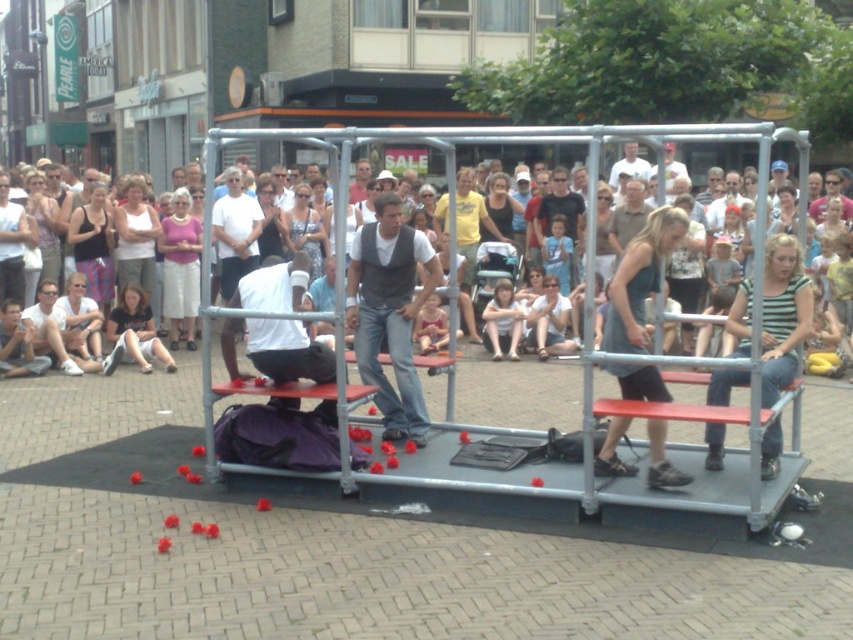
Does denim jeans at center have a lesser height compared to white tank top at center?

No, denim jeans at center is not shorter than white tank top at center.

Is denim jeans at center in front of white tank top at center?

Yes, denim jeans at center is closer to the viewer.

Between point (355, 330) and point (154, 252), which one is positioned in front?

Point (355, 330)

In order to click on denim jeans at center in this screenshot , I will do `click(389, 312)`.

Can you confirm if matte white crowd at center is wider than white tank top at center?

Incorrect, matte white crowd at center's width does not surpass white tank top at center's.

Can you confirm if matte white crowd at center is positioned below white tank top at center?

Correct, matte white crowd at center is located below white tank top at center.

Between point (756, 378) and point (131, 205), which one is positioned behind?

Point (131, 205)

Where is `matte white crowd at center`? matte white crowd at center is located at coordinates (585, 240).

Is matte pink blouse at center below matte gray vest at center?

Indeed, matte pink blouse at center is positioned under matte gray vest at center.

Which is more to the left, matte pink blouse at center or matte gray vest at center?

matte pink blouse at center

Who is more distant from viewer, [163,269] or [639,172]?

Point [639,172]

You are a GUI agent. You are given a task and a screenshot of the screen. Output one action in this format:
    pyautogui.click(x=<x>, y=<y>)
    Task: Click on the matte pink blouse at center
    
    Given the screenshot: What is the action you would take?
    pyautogui.click(x=180, y=268)